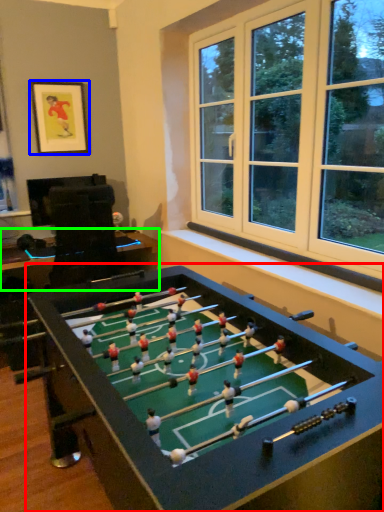
Question: Based on their relative distances, which object is nearer to table (highlighted by a red box)? Choose from picture frame (highlighted by a blue box) and table (highlighted by a green box).

Choices:
 (A) picture frame
 (B) table

Answer: (B)